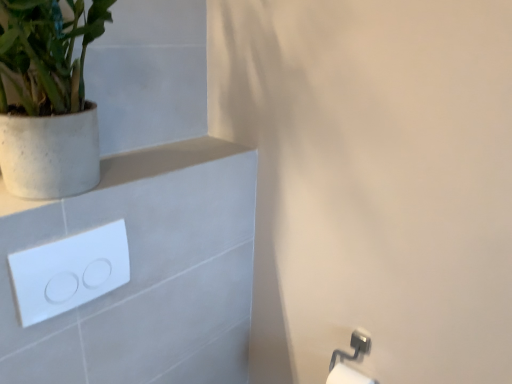
Question: Does white glossy toilet paper at lower right have a larger size compared to white speckled concrete pot at upper left?

Choices:
 (A) yes
 (B) no

Answer: (B)

Question: Considering the relative positions of white glossy toilet paper at lower right and white speckled concrete pot at upper left in the image provided, is white glossy toilet paper at lower right behind white speckled concrete pot at upper left?

Choices:
 (A) yes
 (B) no

Answer: (A)

Question: From the image's perspective, does white glossy toilet paper at lower right appear higher than white speckled concrete pot at upper left?

Choices:
 (A) no
 (B) yes

Answer: (A)

Question: Would you say white glossy toilet paper at lower right is a long distance from white speckled concrete pot at upper left?

Choices:
 (A) yes
 (B) no

Answer: (A)

Question: Is white glossy toilet paper at lower right completely or partially outside of white speckled concrete pot at upper left?

Choices:
 (A) yes
 (B) no

Answer: (A)

Question: Can you confirm if white glossy toilet paper at lower right is thinner than white speckled concrete pot at upper left?

Choices:
 (A) yes
 (B) no

Answer: (A)

Question: Is white speckled concrete pot at upper left oriented away from white matte concrete at upper left?

Choices:
 (A) yes
 (B) no

Answer: (B)

Question: Is white speckled concrete pot at upper left further to the viewer compared to white matte concrete at upper left?

Choices:
 (A) yes
 (B) no

Answer: (B)

Question: Is white speckled concrete pot at upper left to the right of white matte concrete at upper left from the viewer's perspective?

Choices:
 (A) yes
 (B) no

Answer: (B)

Question: Is white speckled concrete pot at upper left shorter than white matte concrete at upper left?

Choices:
 (A) yes
 (B) no

Answer: (B)

Question: From the image's perspective, is white speckled concrete pot at upper left on white matte concrete at upper left?

Choices:
 (A) no
 (B) yes

Answer: (B)

Question: Would you say white speckled concrete pot at upper left is a long distance from white matte concrete at upper left?

Choices:
 (A) no
 (B) yes

Answer: (A)

Question: Is white speckled concrete pot at upper left surrounded by white glossy/light switch at upper left?

Choices:
 (A) no
 (B) yes

Answer: (A)